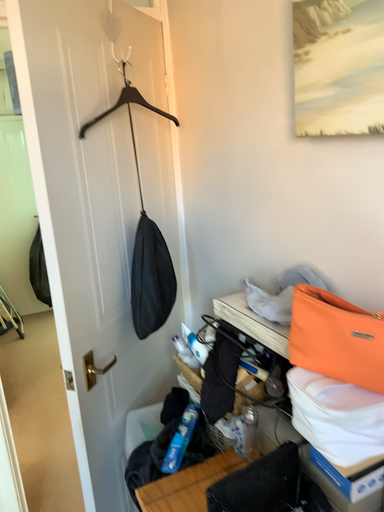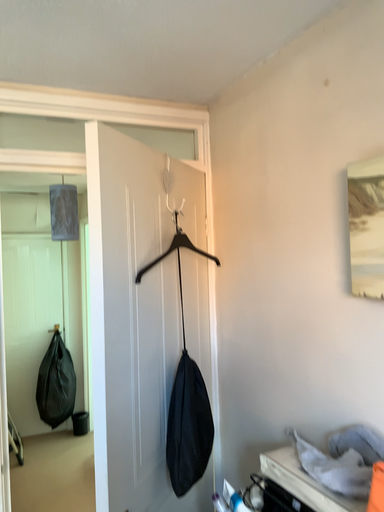
Question: How did the camera likely rotate when shooting the video?

Choices:
 (A) rotated downward
 (B) rotated upward

Answer: (B)